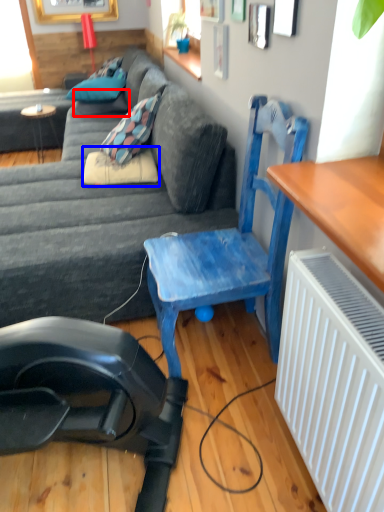
Question: Which object appears farthest to the camera in this image, pillow (highlighted by a red box) or pillow (highlighted by a blue box)?

Choices:
 (A) pillow
 (B) pillow

Answer: (A)